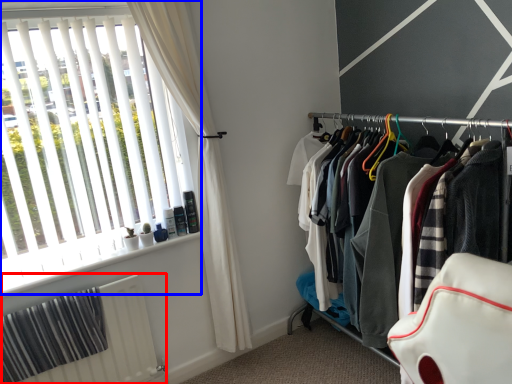
Question: Which point is closer to the camera, radiator (highlighted by a red box) or window (highlighted by a blue box)?

Choices:
 (A) radiator
 (B) window

Answer: (B)